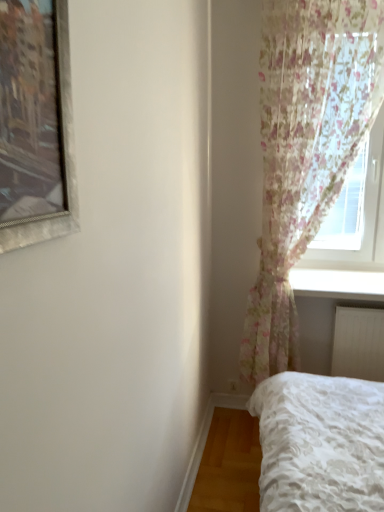
Describe the element at coordinates (358, 343) in the screenshot. I see `white plastic radiator at lower right` at that location.

At what (x,y) coordinates should I click in order to perform the action: click on floral sheer curtain at right. Please return your answer as a coordinate pair (x, y). The width and height of the screenshot is (384, 512). Looking at the image, I should click on (306, 149).

Considering the sizes of objects white glossy window sill at lower right and floral sheer curtain at right in the image provided, who is smaller, white glossy window sill at lower right or floral sheer curtain at right?

white glossy window sill at lower right is smaller.

From the image's perspective, is white glossy window sill at lower right on top of floral sheer curtain at right?

No, from the image's perspective, white glossy window sill at lower right is not over floral sheer curtain at right.

Based on the photo, considering the relative sizes of white glossy window sill at lower right and floral sheer curtain at right in the image provided, is white glossy window sill at lower right wider than floral sheer curtain at right?

Yes, white glossy window sill at lower right is wider than floral sheer curtain at right.

Is point (314, 260) closer or farther from the camera than point (346, 36)?

Point (314, 260).

Does point (372, 360) come in front of point (370, 271)?

Yes, it is in front of point (370, 271).

From the image's perspective, relative to white glossy window sill at lower right, is white plastic radiator at lower right above or below?

white plastic radiator at lower right is below white glossy window sill at lower right.

Between white plastic radiator at lower right and white glossy window sill at lower right, which one has larger size?

white glossy window sill at lower right is bigger.

Is white plastic radiator at lower right thinner than white glossy window sill at lower right?

Yes, white plastic radiator at lower right is thinner than white glossy window sill at lower right.

Which object is thinner, floral sheer curtain at right or white plastic radiator at lower right?

Thinner between the two is white plastic radiator at lower right.

Is white plastic radiator at lower right surrounded by floral sheer curtain at right?

Yes.

This screenshot has width=384, height=512. In the image, there is a white plastic radiator at lower right. What are the coordinates of `curtain above it (from the image's perspective)` in the screenshot? It's located at (306, 149).

Who is shorter, floral sheer curtain at right or white plastic radiator at lower right?

With less height is white plastic radiator at lower right.

Between floral sheer curtain at right and white glossy window sill at lower right, which one is positioned behind?

white glossy window sill at lower right is further from the camera.

Is floral sheer curtain at right in contact with white glossy window sill at lower right?

No, floral sheer curtain at right is not next to white glossy window sill at lower right.

Measure the distance between floral sheer curtain at right and white glossy window sill at lower right.

The distance of floral sheer curtain at right from white glossy window sill at lower right is 21.09 inches.

Is point (286, 2) more distant than point (312, 276)?

That is False.

Is white plastic radiator at lower right not within floral sheer curtain at right?

Actually, white plastic radiator at lower right is at least partially inside floral sheer curtain at right.

From the image's perspective, which object appears higher, white plastic radiator at lower right or floral sheer curtain at right?

floral sheer curtain at right, from the image's perspective.

In the scene shown: From a real-world perspective, is white plastic radiator at lower right physically above floral sheer curtain at right?

Actually, white plastic radiator at lower right is physically below floral sheer curtain at right in the real world.

Who is bigger, white plastic radiator at lower right or floral sheer curtain at right?

floral sheer curtain at right is bigger.

Considering the positions of point (338, 288) and point (360, 326), is point (338, 288) closer or farther from the camera than point (360, 326)?

Point (338, 288) is positioned closer to the camera compared to point (360, 326).

In the scene shown: Considering the sizes of objects white glossy window sill at lower right and white plastic radiator at lower right in the image provided, who is bigger, white glossy window sill at lower right or white plastic radiator at lower right?

Bigger between the two is white glossy window sill at lower right.

Is white glossy window sill at lower right oriented away from white plastic radiator at lower right?

No, white glossy window sill at lower right's orientation is not away from white plastic radiator at lower right.

From a real-world perspective, between white glossy window sill at lower right and white plastic radiator at lower right, who is vertically higher?

In real-world perspective, white glossy window sill at lower right is above.

Identify the location of curtain lying above the white glossy window sill at lower right (from the image's perspective). (306, 149).

The height and width of the screenshot is (512, 384). What are the coordinates of `window sill lying in front of the white plastic radiator at lower right` in the screenshot? It's located at (338, 279).

Considering their positions, is white plastic radiator at lower right positioned further to white glossy window sill at lower right than floral sheer curtain at right?

Based on the image, floral sheer curtain at right appears to be further to white glossy window sill at lower right.

From the image, which object appears to be farther from floral sheer curtain at right, white glossy window sill at lower right or white plastic radiator at lower right?

white plastic radiator at lower right lies further to floral sheer curtain at right than the other object.

When comparing their distances from white glossy window sill at lower right, does floral sheer curtain at right or white plastic radiator at lower right seem closer?

white plastic radiator at lower right.

Which object lies further to the anchor point floral sheer curtain at right, white plastic radiator at lower right or white glossy window sill at lower right?

white plastic radiator at lower right lies further to floral sheer curtain at right than the other object.

From the picture: Estimate the real-world distances between objects in this image. Which object is closer to white plastic radiator at lower right, white glossy window sill at lower right or floral sheer curtain at right?

The object closer to white plastic radiator at lower right is white glossy window sill at lower right.

Considering their positions, is floral sheer curtain at right positioned further to white plastic radiator at lower right than white glossy window sill at lower right?

floral sheer curtain at right is further to white plastic radiator at lower right.

The image size is (384, 512). Identify the location of window sill between floral sheer curtain at right and white plastic radiator at lower right in the up-down direction. (338, 279).